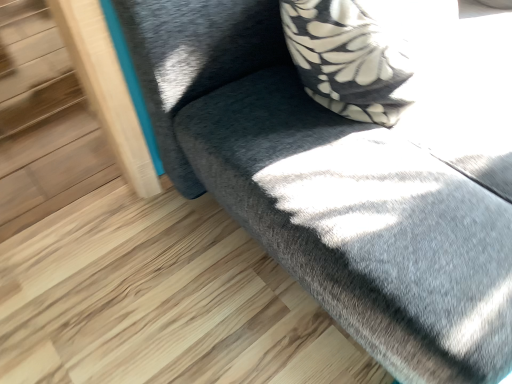
Looking at this image, what is the approximate width of transparent glass door at left?

transparent glass door at left is 1.59 meters wide.

This screenshot has height=384, width=512. What are the coordinates of `transparent glass door at left` in the screenshot? It's located at (46, 134).

Describe the element at coordinates (46, 134) in the screenshot. I see `transparent glass door at left` at that location.

The height and width of the screenshot is (384, 512). Identify the location of transparent glass door at left. (46, 134).